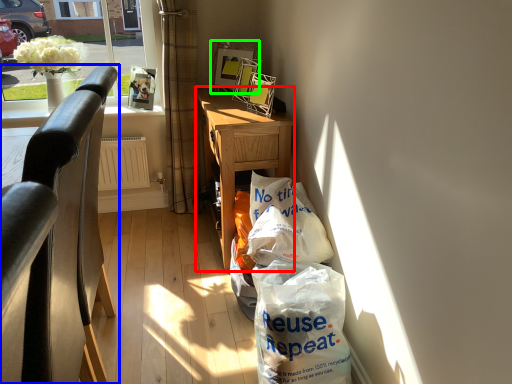
Question: Which object is positioned closest to desk (highlighted by a red box)? Select from chair (highlighted by a blue box) and picture frame (highlighted by a green box).

Choices:
 (A) chair
 (B) picture frame

Answer: (B)